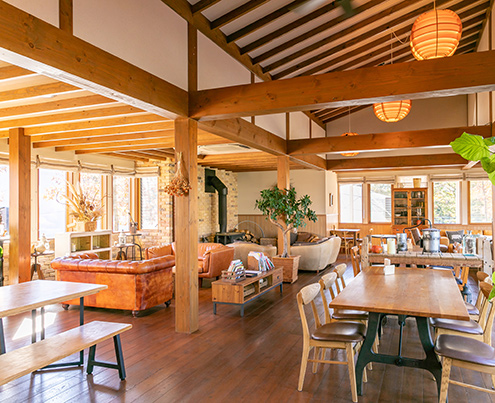
Where is `brown leather couch`? The image size is (495, 403). brown leather couch is located at coordinates (120, 262), (213, 250).